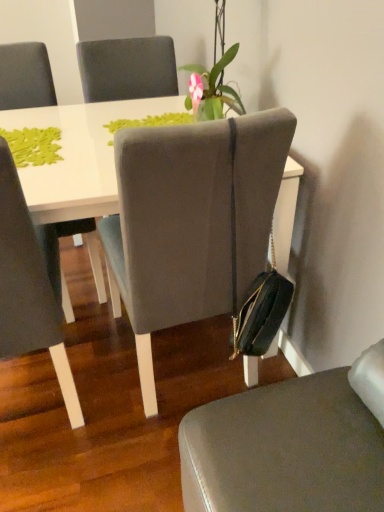
Question: From a real-world perspective, is matte gray chair at left, positioned as the third chair in right-to-left order, above or below suede-like gray chair at center, which is the second chair in right-to-left order?

Choices:
 (A) below
 (B) above

Answer: (A)

Question: Is matte gray chair at left, the 1th chair viewed from the left, situated inside suede-like gray chair at center, which is the second chair in right-to-left order, or outside?

Choices:
 (A) inside
 (B) outside

Answer: (B)

Question: Which object is the closest to the matte gray chair at center, arranged as the 3th chair when viewed from the left?

Choices:
 (A) green matte plant at upper center
 (B) suede-like gray chair at center, placed as the 2th chair when sorted from left to right
 (C) matte gray chair at left, the 1th chair viewed from the left

Answer: (B)

Question: Estimate the real-world distances between objects in this image. Which object is farther from the matte gray chair at center, arranged as the 3th chair when viewed from the left?

Choices:
 (A) matte gray chair at left, positioned as the third chair in right-to-left order
 (B) suede-like gray chair at center, which is the second chair in right-to-left order
 (C) green matte plant at upper center

Answer: (C)